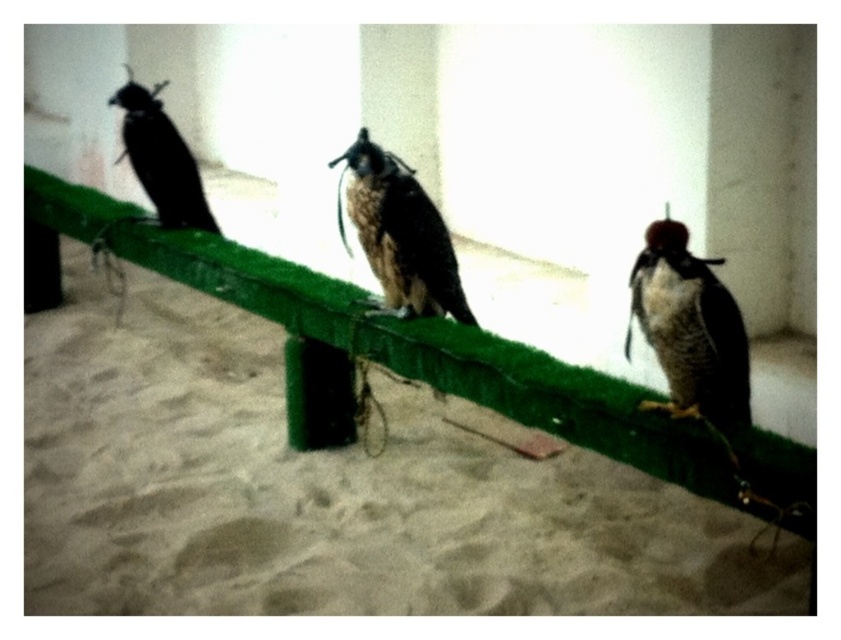
Looking at this image, who is positioned more to the right, green artificial grass at center or brown feathered falcon at center?

Positioned to the right is brown feathered falcon at center.

Between point (593, 372) and point (374, 216), which one is positioned in front?

Point (593, 372)

Who is more distant from viewer, (124, 240) or (379, 276)?

Positioned behind is point (124, 240).

Find the location of `green artificial grass at center`. green artificial grass at center is located at coordinates (400, 339).

Is green artificial grass at center taller than dark brown feathers at right?

Correct, green artificial grass at center is much taller as dark brown feathers at right.

Is point (800, 483) positioned behind point (680, 259)?

No.

Identify the location of green artificial grass at center. (400, 339).

Can you confirm if green artificial grass at center is shorter than black matte falcon at left?

In fact, green artificial grass at center may be taller than black matte falcon at left.

Image resolution: width=841 pixels, height=640 pixels. I want to click on green artificial grass at center, so (400, 339).